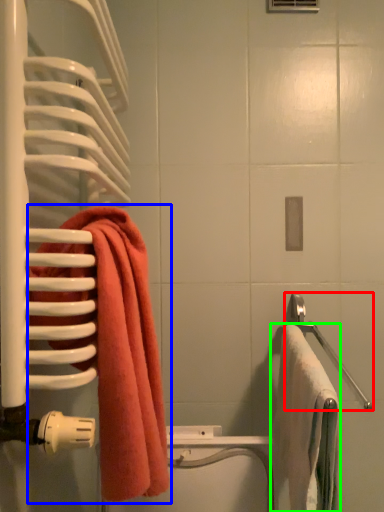
Question: Based on their relative distances, which object is nearer to towel bar (highlighted by a red box)? Choose from towel (highlighted by a blue box) and towel (highlighted by a green box).

Choices:
 (A) towel
 (B) towel

Answer: (B)